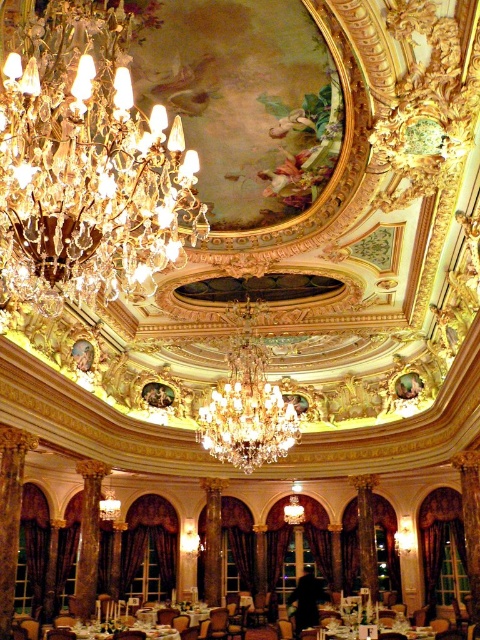
Question: In this image, where is crystal glass chandelier at upper left located relative to wooden polished table at center?

Choices:
 (A) below
 (B) above

Answer: (B)

Question: Which object is farther from the camera taking this photo?

Choices:
 (A) wooden polished table at center
 (B) white glossy table at center
 (C) clear crystal chandelier at center
 (D) white glossy table at lower center

Answer: (A)

Question: Is clear crystal chandelier at center wider than wooden polished table at center?

Choices:
 (A) yes
 (B) no

Answer: (A)

Question: Can you confirm if clear crystal chandelier at center is positioned above wooden polished table at center?

Choices:
 (A) no
 (B) yes

Answer: (B)

Question: Estimate the real-world distances between objects in this image. Which object is closer to the white glossy table at lower center?

Choices:
 (A) white glossy table at center
 (B) clear crystal chandelier at center
 (C) wooden polished table at center

Answer: (C)

Question: Which of the following is the farthest from the observer?

Choices:
 (A) crystal glass chandelier at upper left
 (B) white glossy table at center
 (C) wooden polished table at center

Answer: (C)